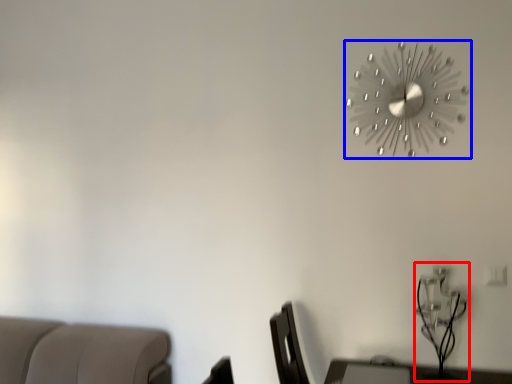
Question: Among these objects, which one is nearest to the camera, table lamp (highlighted by a red box) or wall clock (highlighted by a blue box)?

Choices:
 (A) table lamp
 (B) wall clock

Answer: (A)